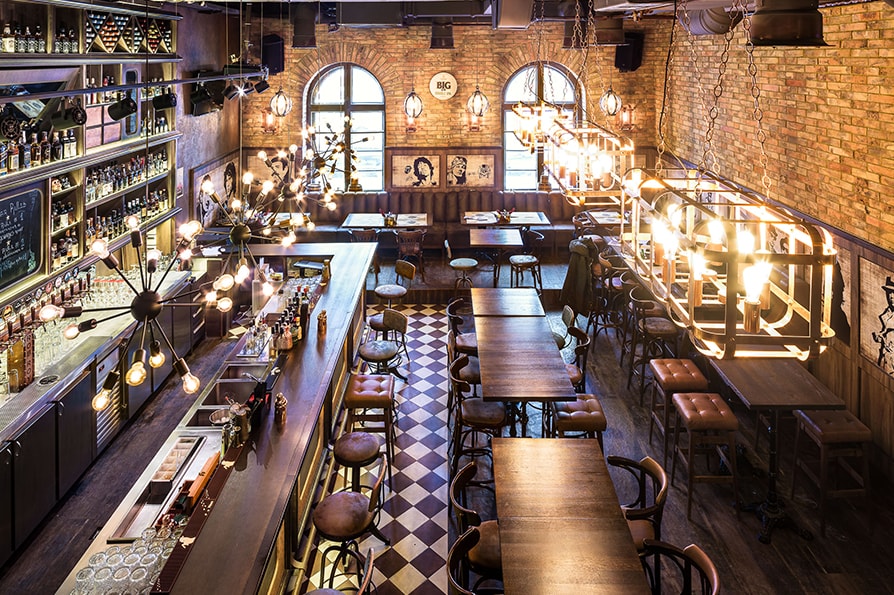
The image size is (894, 595). What are the coordinates of `tables` in the screenshot? It's located at (407, 219), (498, 215), (499, 237), (605, 214), (763, 377), (546, 366), (508, 300), (549, 493).